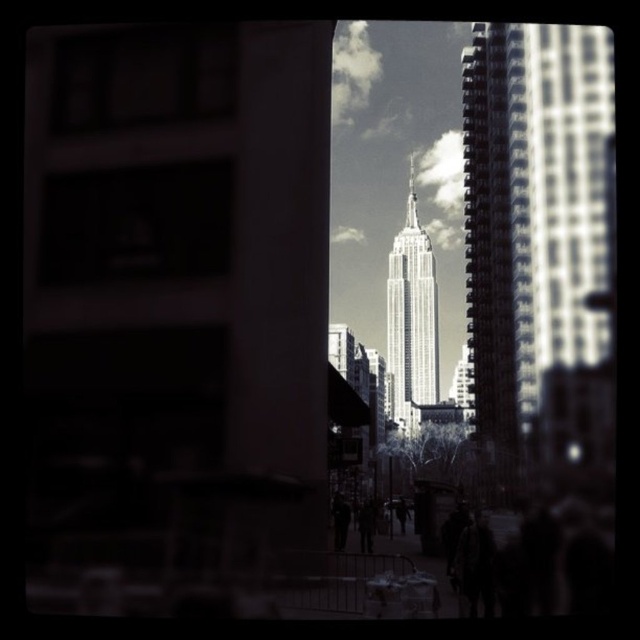
Is white glass tower at center further to camera compared to dark clothing at center?

Yes.

Measure the distance between point (419, 260) and camera.

Point (419, 260) is 354.88 meters from camera.

Which is behind, point (412, 376) or point (404, 508)?

The point (412, 376) is behind.

This screenshot has width=640, height=640. What are the coordinates of `white glass tower at center` in the screenshot? It's located at (412, 321).

Which of these two, dark brown leather jacket at lower center or dark fabric coat at center, stands shorter?

Standing shorter between the two is dark fabric coat at center.

Based on the photo, who is more forward, (484, 544) or (337, 545)?

Point (484, 544) is more forward.

What are the coordinates of `dark brown leather jacket at lower center` in the screenshot? It's located at (476, 564).

Between point (570, 179) and point (358, 518), which one is positioned behind?

Point (570, 179)

Can you confirm if smooth glass skyscraper at center is wider than dark gray pants at center?

Correct, the width of smooth glass skyscraper at center exceeds that of dark gray pants at center.

This screenshot has height=640, width=640. I want to click on smooth glass skyscraper at center, so click(x=532, y=218).